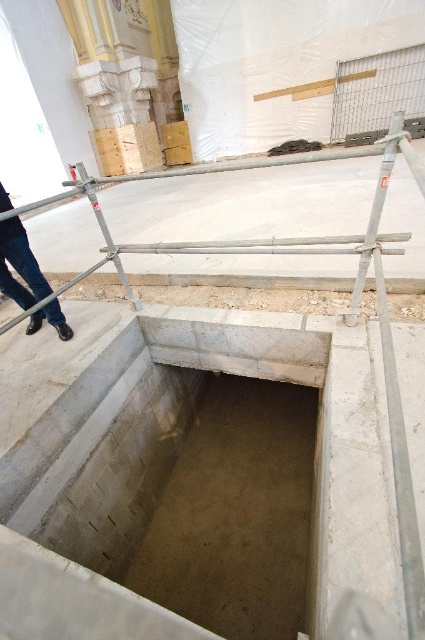
You are a worker standing at the entrance of the construction site. You see the metal scaffolding at center and the blue jeans at left. Which object is closer to you?

The metal scaffolding at center is closer to you since it is in front of the blue jeans at left.

You are a worker who needs to reach the top of the metal scaffolding at center to secure some equipment. Considering the height of the blue jeans at left, can you estimate whether the scaffolding is tall enough for you to climb safely?

The metal scaffolding at center is much taller than the blue jeans at left, so it should be tall enough for a worker to climb safely to the top.